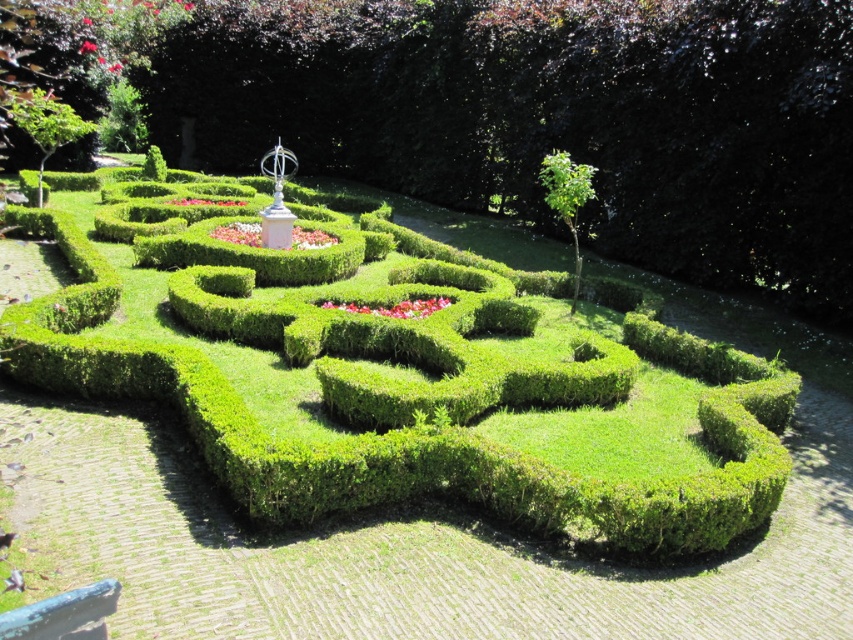
Is the position of green hedge maze at center less distant than that of green leafy bush at upper right?

Yes, green hedge maze at center is in front of green leafy bush at upper right.

Does point (366, 448) lie behind point (595, 193)?

No, it is in front of (595, 193).

Where is `green hedge maze at center`? green hedge maze at center is located at coordinates [439, 429].